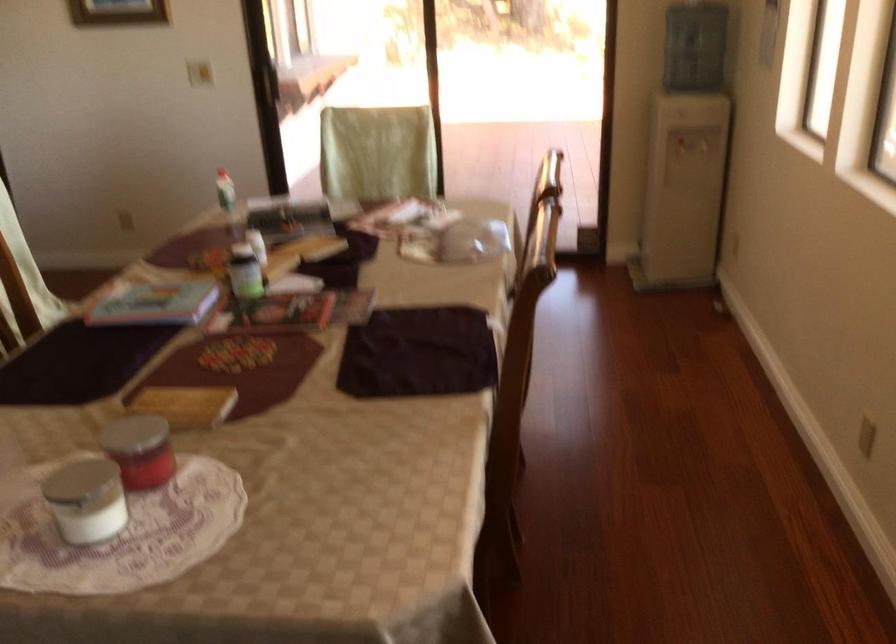
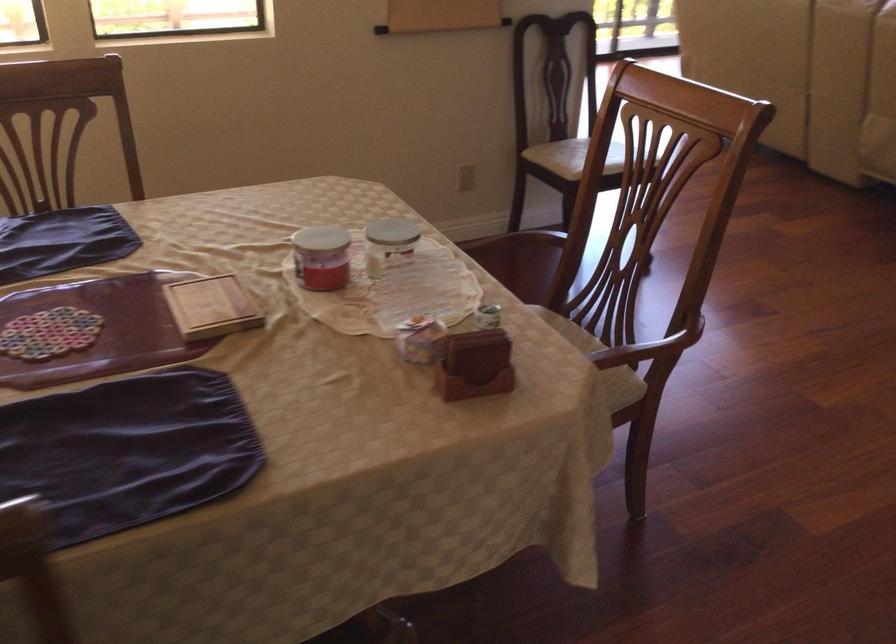
The point at (176, 404) is marked in the first image. Where is the corresponding point in the second image?

(211, 307)